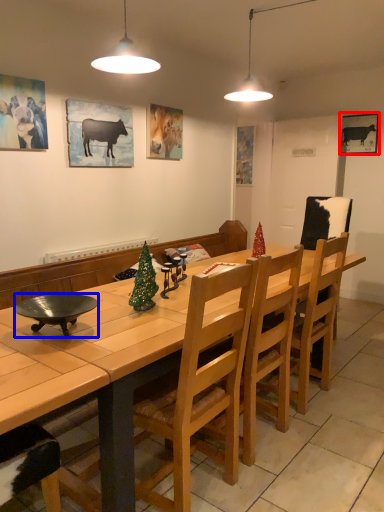
Question: Among these objects, which one is nearest to the camera, picture frame (highlighted by a red box) or bowl (highlighted by a blue box)?

Choices:
 (A) picture frame
 (B) bowl

Answer: (B)